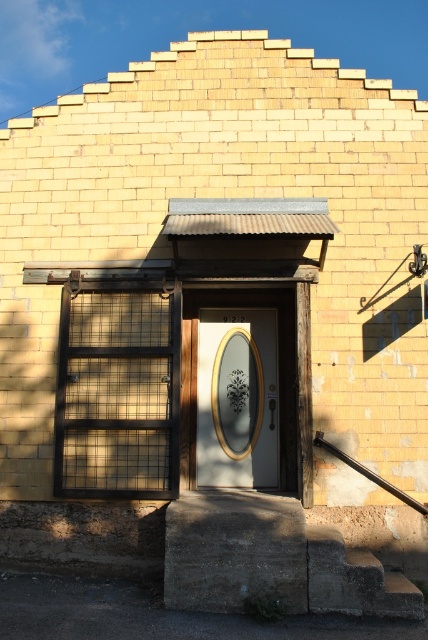
Question: Is matte gold door at center further to the viewer compared to concrete/stone stairs at lower center?

Choices:
 (A) no
 (B) yes

Answer: (B)

Question: Can you confirm if concrete/stone stairs at lower center is thinner than brown wooden rail at right?

Choices:
 (A) no
 (B) yes

Answer: (B)

Question: Can you confirm if matte gold door at center is bigger than brown wooden rail at right?

Choices:
 (A) yes
 (B) no

Answer: (A)

Question: Which object is closer to the camera taking this photo?

Choices:
 (A) brown wooden rail at right
 (B) matte gold door at center

Answer: (A)

Question: Which is farther from the concrete/stone stairs at lower center?

Choices:
 (A) matte gold door at center
 (B) brown wooden rail at right

Answer: (A)

Question: Which of these objects is positioned closest to the concrete/stone stairs at lower center?

Choices:
 (A) brown wooden rail at right
 (B) matte gold door at center

Answer: (A)